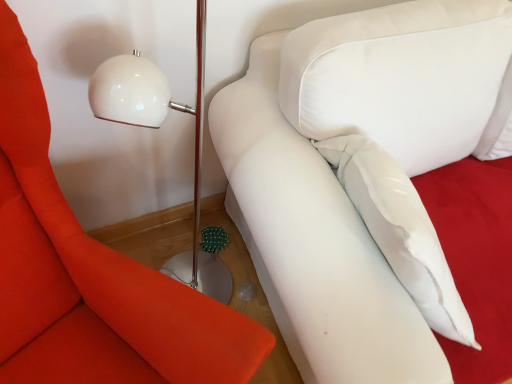
Question: From the image's perspective, does white soft couch at upper right appear higher than white fabric pillow at upper right?

Choices:
 (A) no
 (B) yes

Answer: (B)

Question: From the image's perspective, is white soft couch at upper right beneath white fabric pillow at upper right?

Choices:
 (A) yes
 (B) no

Answer: (B)

Question: Is white soft couch at upper right looking in the opposite direction of white fabric pillow at upper right?

Choices:
 (A) no
 (B) yes

Answer: (A)

Question: Is white soft couch at upper right far away from white fabric pillow at upper right?

Choices:
 (A) no
 (B) yes

Answer: (A)

Question: Considering the relative sizes of white soft couch at upper right and white fabric pillow at upper right in the image provided, is white soft couch at upper right thinner than white fabric pillow at upper right?

Choices:
 (A) yes
 (B) no

Answer: (B)

Question: Does white soft couch at upper right have a larger size compared to white fabric pillow at upper right?

Choices:
 (A) yes
 (B) no

Answer: (A)

Question: Is white fabric pillow at upper right smaller than white soft couch at upper right?

Choices:
 (A) yes
 (B) no

Answer: (A)

Question: Does white fabric pillow at upper right have a greater height compared to white soft couch at upper right?

Choices:
 (A) yes
 (B) no

Answer: (A)

Question: Is white fabric pillow at upper right closer to the viewer compared to white soft couch at upper right?

Choices:
 (A) no
 (B) yes

Answer: (B)

Question: Does white fabric pillow at upper right lie behind white soft couch at upper right?

Choices:
 (A) yes
 (B) no

Answer: (B)

Question: Considering the relative sizes of white fabric pillow at upper right and white soft couch at upper right in the image provided, is white fabric pillow at upper right bigger than white soft couch at upper right?

Choices:
 (A) no
 (B) yes

Answer: (A)

Question: Is white fabric pillow at upper right with white soft couch at upper right?

Choices:
 (A) no
 (B) yes

Answer: (A)

Question: Considering the positions of white soft couch at upper right and white fabric pillow at upper right in the image, is white soft couch at upper right bigger or smaller than white fabric pillow at upper right?

Choices:
 (A) small
 (B) big

Answer: (B)